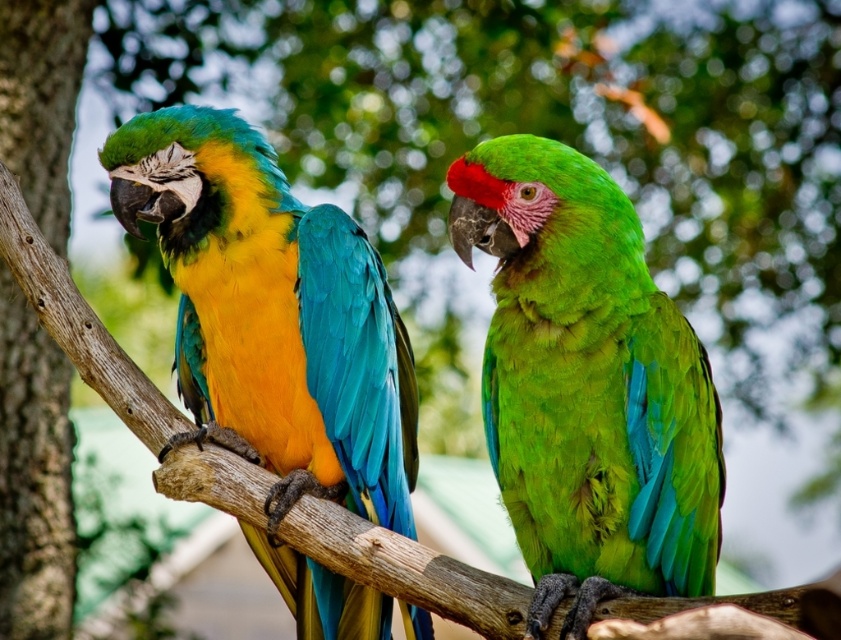
Which is more to the right, green matte parrot at center or shiny multicolored parrot at left?

green matte parrot at center is more to the right.

Does green matte parrot at center have a greater height compared to shiny multicolored parrot at left?

Incorrect, green matte parrot at center's height is not larger of shiny multicolored parrot at left's.

Who is more forward, (551, 531) or (279, 198)?

Point (551, 531) is in front.

Locate an element on the screen. green matte parrot at center is located at coordinates tap(586, 385).

Between shiny multicolored parrot at left and rough bark tree trunk at left, which one appears on the right side from the viewer's perspective?

Positioned to the right is shiny multicolored parrot at left.

Who is shorter, shiny multicolored parrot at left or rough bark tree trunk at left?

With less height is shiny multicolored parrot at left.

The image size is (841, 640). Describe the element at coordinates (278, 340) in the screenshot. I see `shiny multicolored parrot at left` at that location.

Locate an element on the screen. This screenshot has width=841, height=640. shiny multicolored parrot at left is located at coordinates (278, 340).

Is green matte parrot at center shorter than rough bark tree trunk at left?

Indeed, green matte parrot at center has a lesser height compared to rough bark tree trunk at left.

Is green matte parrot at center wider than rough bark tree trunk at left?

Indeed, green matte parrot at center has a greater width compared to rough bark tree trunk at left.

Identify the location of green matte parrot at center. (586, 385).